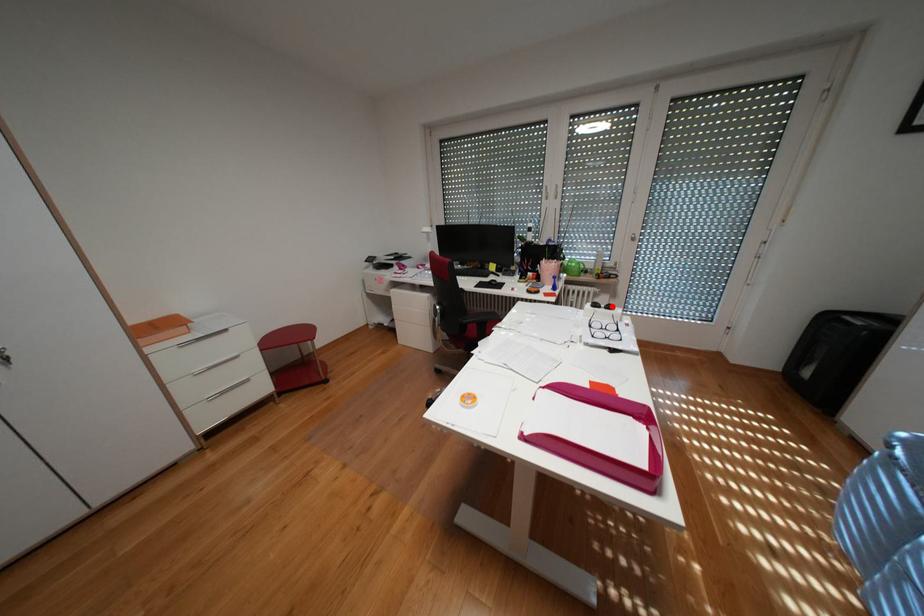
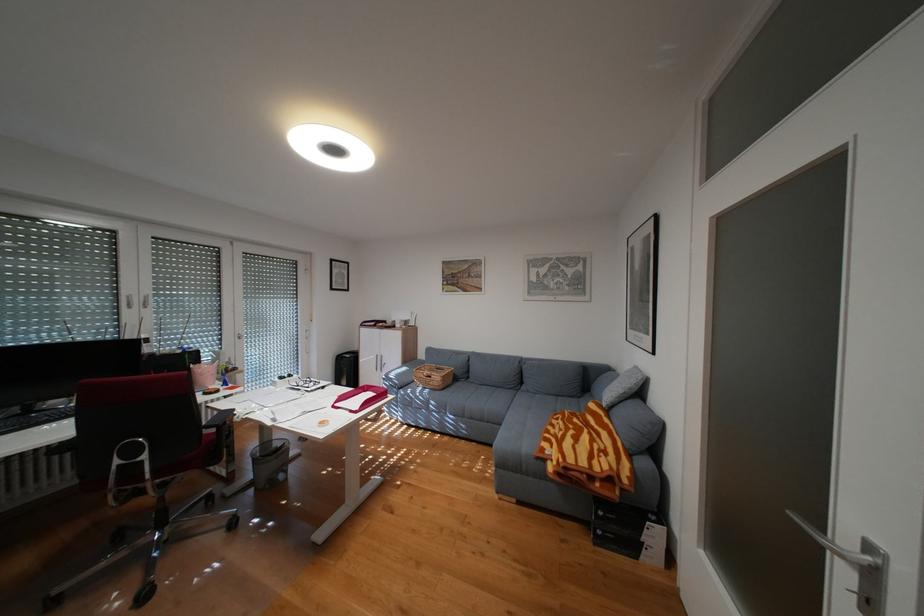
Question: I am providing you with two images of the same scene from different viewpoints. In image1, a red point is highlighted. Considering the same 3D point in image2, which of the following is correct?

Choices:
 (A) It is closer
 (B) It is farther

Answer: (A)